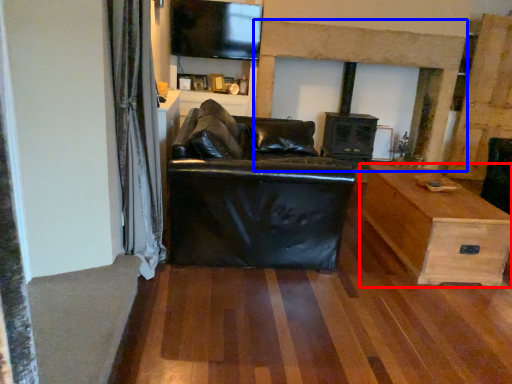
Question: Among these objects, which one is farthest to the camera, table (highlighted by a red box) or fireplace (highlighted by a blue box)?

Choices:
 (A) table
 (B) fireplace

Answer: (B)